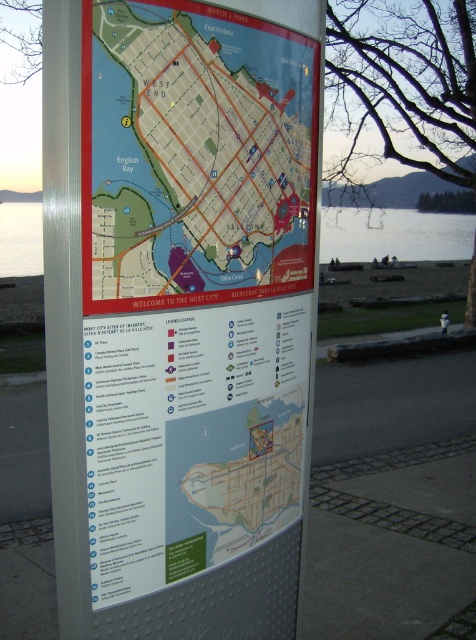
How far apart are matte paper map at center and clear water at lower left?

matte paper map at center is 6.00 feet away from clear water at lower left.

Can you confirm if matte paper map at center is positioned above clear water at lower left?

No.

Who is more forward, (206, 60) or (343, 221)?

Point (206, 60)

Locate an element on the screen. The width and height of the screenshot is (476, 640). matte paper map at center is located at coordinates (195, 156).